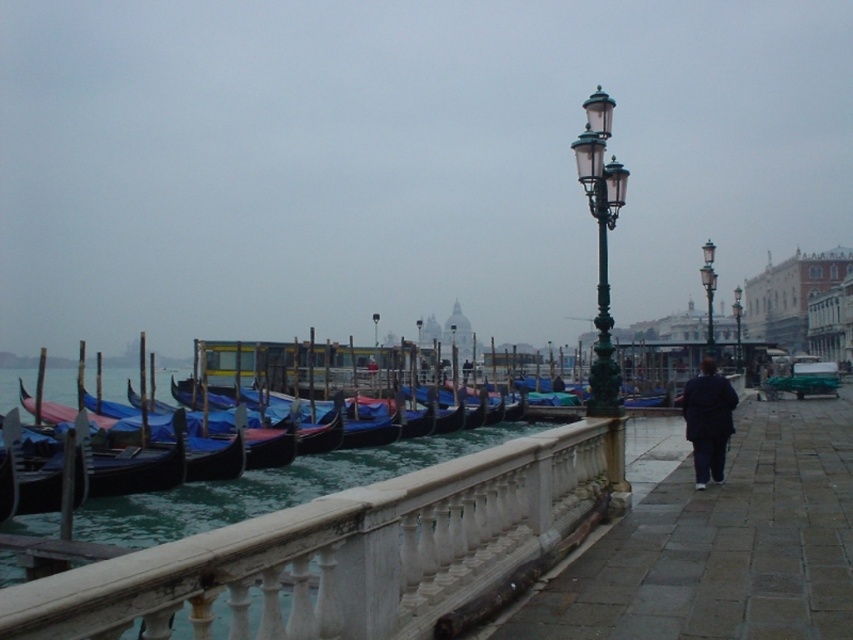
You are a tourist in Venice and want to take a photo of the iconic dome of St. Mark Basilica. You notice two green glass streetlights in front of you. One is labeled as the green glass streetlamp at center and the other as the green glass streetlight at center. Which one is blocking your view of the basilica dome?

The green glass streetlamp at center is located below the green glass streetlight at center. Since the streetlamp is below the streetlight, the streetlight at center is higher and might be blocking the view of the basilica dome. However, both are at the same position, so they might be the same object. Please check the labels again for accuracy.